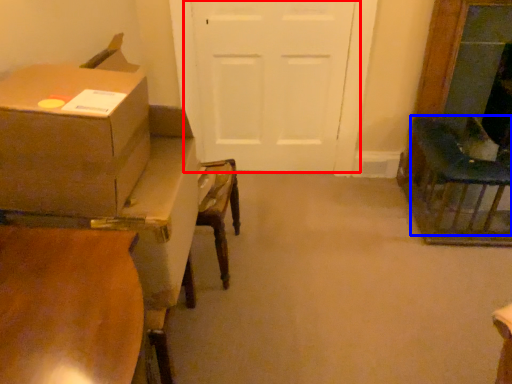
Question: Which object is further to the camera taking this photo, door (highlighted by a red box) or chair (highlighted by a blue box)?

Choices:
 (A) door
 (B) chair

Answer: (A)